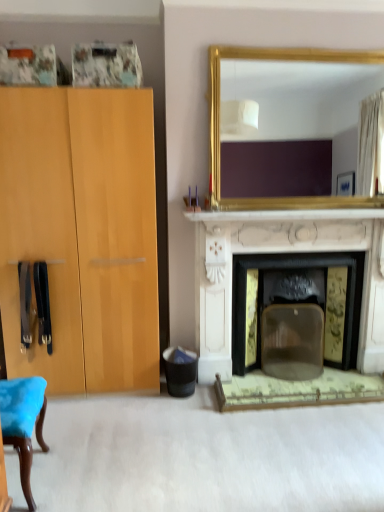
Question: Is the surface of black plastic trash bin at lower center in direct contact with gold-framed mirror at upper center?

Choices:
 (A) no
 (B) yes

Answer: (A)

Question: Is black plastic trash bin at lower center smaller than gold-framed mirror at upper center?

Choices:
 (A) no
 (B) yes

Answer: (B)

Question: Are black plastic trash bin at lower center and gold-framed mirror at upper center located far from each other?

Choices:
 (A) yes
 (B) no

Answer: (A)

Question: Is black plastic trash bin at lower center facing away from gold-framed mirror at upper center?

Choices:
 (A) no
 (B) yes

Answer: (A)

Question: Is black plastic trash bin at lower center shorter than gold-framed mirror at upper center?

Choices:
 (A) yes
 (B) no

Answer: (A)

Question: Is black plastic trash bin at lower center positioned beyond the bounds of gold-framed mirror at upper center?

Choices:
 (A) yes
 (B) no

Answer: (A)

Question: Is gold-framed mirror at upper center positioned behind black plastic trash bin at lower center?

Choices:
 (A) no
 (B) yes

Answer: (A)

Question: Could you tell me if gold-framed mirror at upper center is facing black plastic trash bin at lower center?

Choices:
 (A) yes
 (B) no

Answer: (B)

Question: From a real-world perspective, is gold-framed mirror at upper center under black plastic trash bin at lower center?

Choices:
 (A) no
 (B) yes

Answer: (A)

Question: Is gold-framed mirror at upper center smaller than black plastic trash bin at lower center?

Choices:
 (A) no
 (B) yes

Answer: (A)

Question: Is gold-framed mirror at upper center to the right of black plastic trash bin at lower center from the viewer's perspective?

Choices:
 (A) yes
 (B) no

Answer: (A)

Question: Can you confirm if gold-framed mirror at upper center is taller than black plastic trash bin at lower center?

Choices:
 (A) no
 (B) yes

Answer: (B)

Question: From a real-world perspective, is black plastic trash bin at lower center physically above white marble fireplace at center?

Choices:
 (A) yes
 (B) no

Answer: (B)